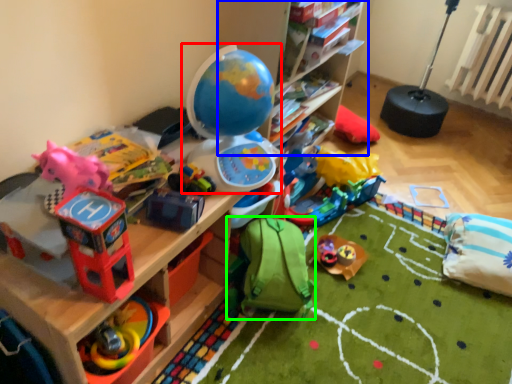
Question: Considering the real-world distances, which object is closest to toy (highlighted by a red box)? shelf (highlighted by a blue box) or toy (highlighted by a green box).

Choices:
 (A) shelf
 (B) toy

Answer: (B)